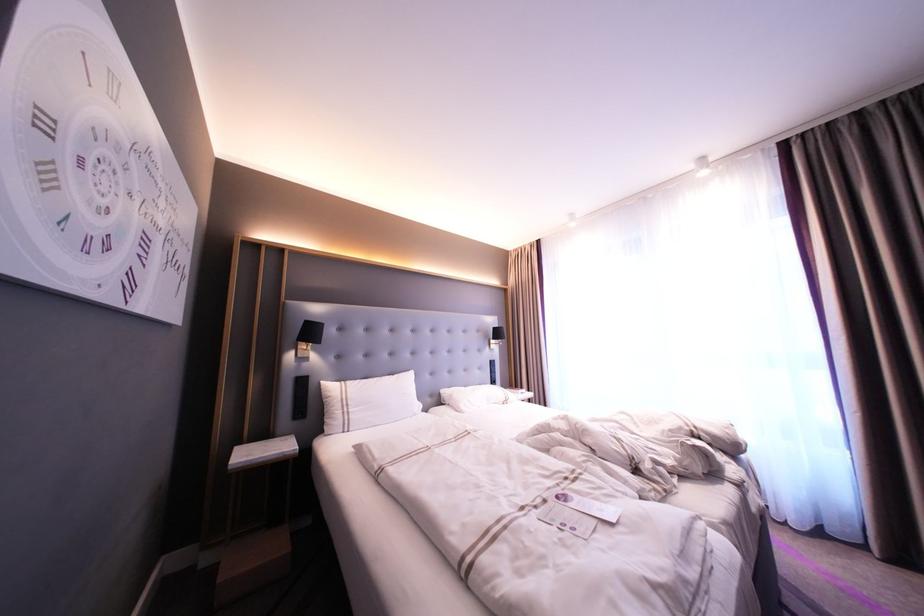
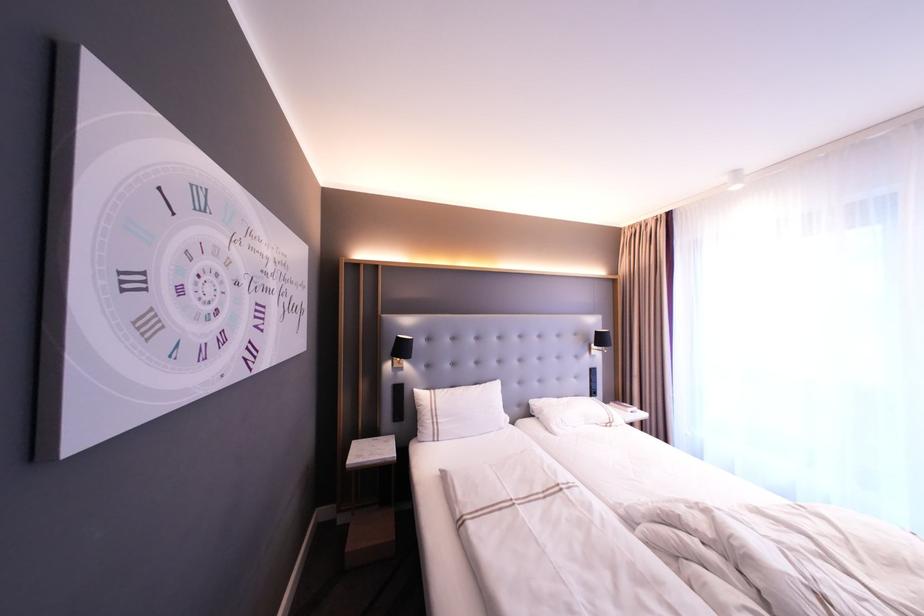
Find the pixel in the second image that matches (346,411) in the first image.

(435, 422)